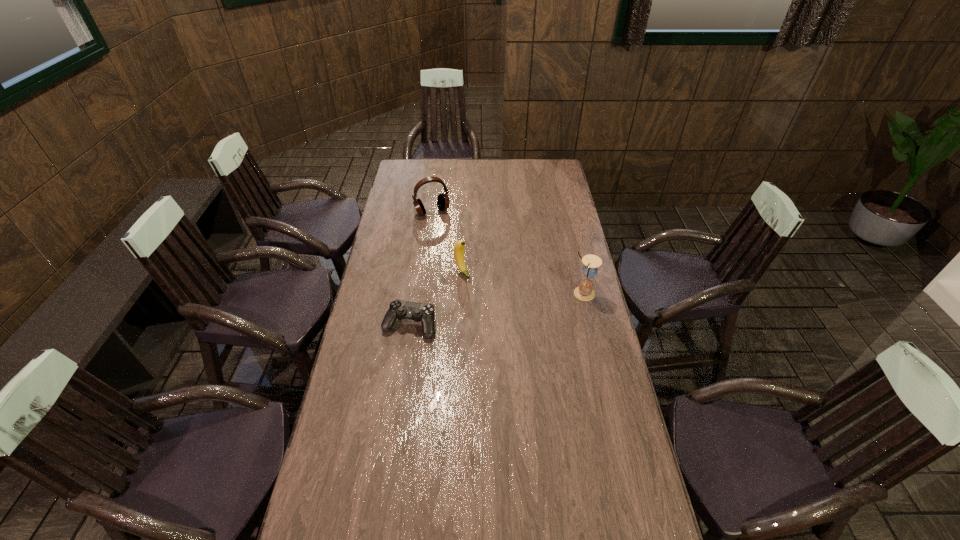
In order to click on free spot on the desktop that is between the nearest object and the hourglass and is positioned from the stem of the second farthest object in this screenshot , I will do `click(495, 309)`.

This screenshot has height=540, width=960. In order to click on free space on the desktop that is between the nearest object and the third farthest object and is positioned on the ear pads of the headset in this screenshot , I will do `click(488, 310)`.